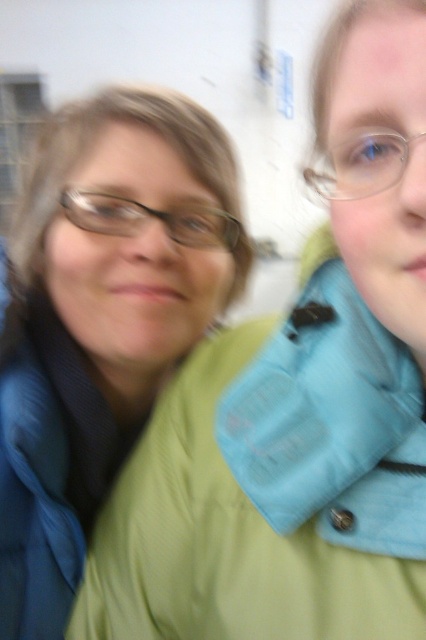
You are trying to determine the spatial relationship between the green matte jacket at upper left and the matte black glasses at left. Based on the scene, which object is closer to the viewer?

The green matte jacket at upper left is closer to the viewer than the matte black glasses at left because it is in front of it.

You are a fashion designer who wants to create a coordinated outfit using the green matte jacket at upper left and the clear plastic glasses at upper right. Which item should be placed higher on the body to ensure proper layering?

The clear plastic glasses at upper right should be placed higher on the body since the green matte jacket at upper left is located below it, allowing the glasses to sit naturally above the jacket.